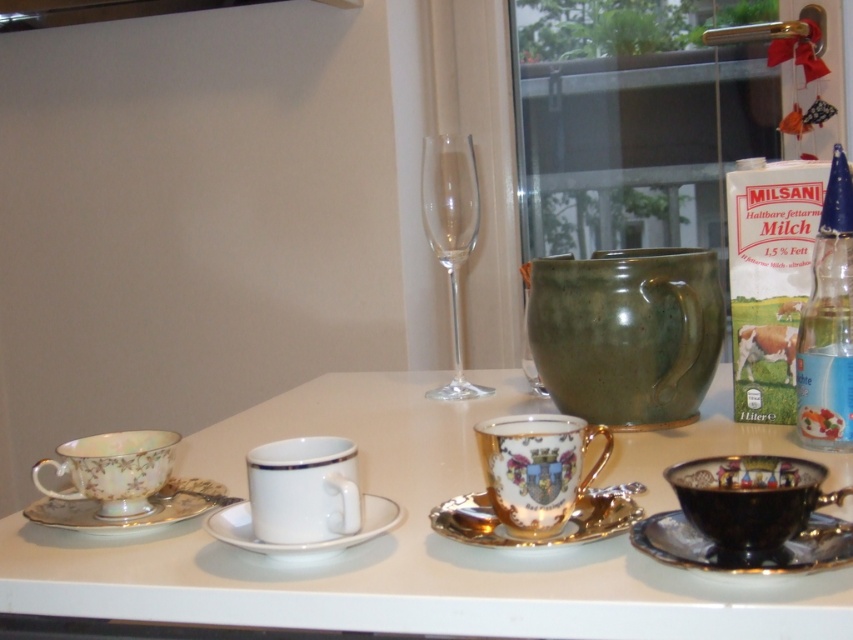
You are taking a photo of the two points in the scene. Which point, point (310, 493) or point (218, 518), will appear larger in your photo?

Point (310, 493) is closer to the camera than point (218, 518), so it will appear larger in the photo.

Based on the photo, you have a small cookie that needs to be placed on either the green matte teacup at center or the porcelain floral saucer at left. Considering their sizes, which one would allow the cookie to fit better?

The green matte teacup at center has a larger width than the porcelain floral saucer at left, so the cookie would fit better on the green matte teacup at center.

You are a delivery robot with a 12 inch wide tray. You need to place your tray between the two objects at point (329, 529). Can you fit your tray there?

The distance between the two objects at point (329, 529) is 23.08 inches, so yes, the robot can fit its 12 inch wide tray between them since the space is wider than the tray.